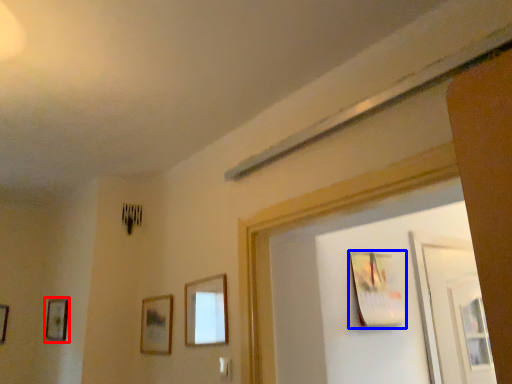
Question: Among these objects, which one is farthest to the camera, picture frame (highlighted by a red box) or picture frame (highlighted by a blue box)?

Choices:
 (A) picture frame
 (B) picture frame

Answer: (A)